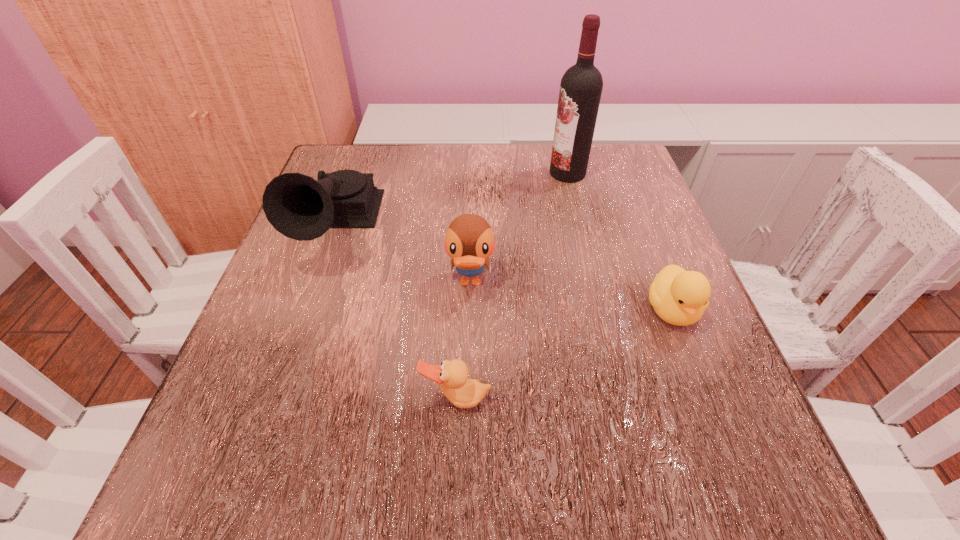
Locate an element on the screen. Image resolution: width=960 pixels, height=540 pixels. free spot between the second tallest object and the rightmost object is located at coordinates coord(504,271).

Select which object is the closest to the phonograph_record. Please provide its 2D coordinates. Your answer should be formatted as a tuple, i.e. [(x, y)], where the tuple contains the x and y coordinates of a point satisfying the conditions above.

[(469, 241)]

You are a GUI agent. You are given a task and a screenshot of the screen. Output one action in this format:
    pyautogui.click(x=<x>, y=<y>)
    Task: Click on the object that stands as the second closest to the third tallest object
    This screenshot has height=540, width=960.
    Given the screenshot: What is the action you would take?
    pyautogui.click(x=452, y=376)

This screenshot has height=540, width=960. I want to click on duck that is the nearest to the rightmost object, so pyautogui.click(x=469, y=241).

Locate an element on the screen. The width and height of the screenshot is (960, 540). duck that is the third nearest to the phonograph_record is located at coordinates (679, 297).

Locate an element on the screen. vacant position in the image that satisfies the following two spatial constraints: 1. on the label of the farthest object; 2. on the beak of the shortest duck is located at coordinates (623, 399).

Image resolution: width=960 pixels, height=540 pixels. I want to click on free space that satisfies the following two spatial constraints: 1. on the label of the farthest object; 2. on the front-facing side of the third tallest object, so click(x=594, y=283).